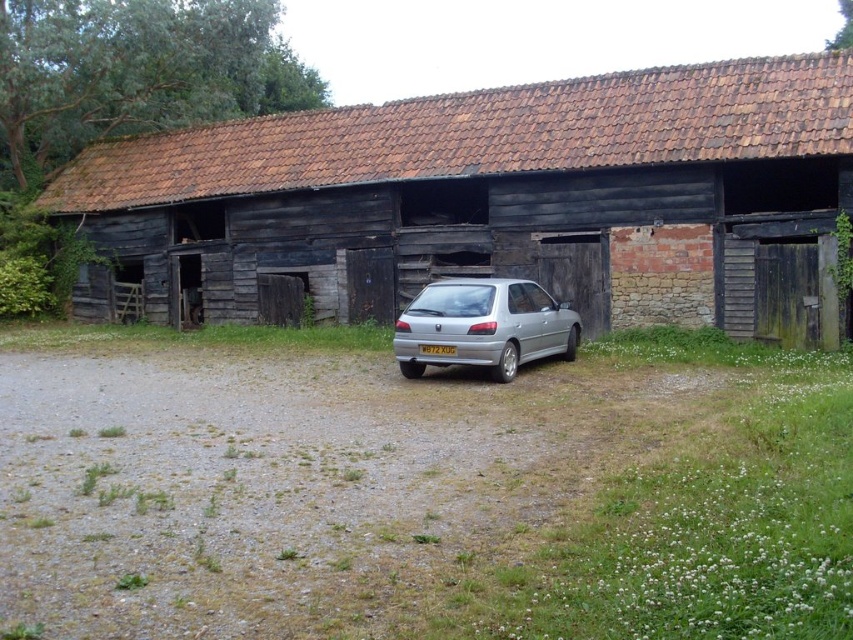
You are a photographer trying to capture the entire rustic wooden barn at center and silver metallic hatchback at center in a single frame. Given that your camera can only focus on objects within a 10 meter width, will you be able to fit both objects in the frame?

The rustic wooden barn at center is wider than the silver metallic hatchback at center. Since the barn is wider, it might exceed the 10 meter width limit, making it difficult to fit both in the frame. However, without knowing the exact width of the barn, we can only confirm that the barn is wider than the car.

You are standing in front of the barn and want to park your car exactly where the silver metallic hatchback at center is parked. What are the coordinates of the parking spot?

The coordinates of the parking spot for the silver metallic hatchback at center are at point (485,324).